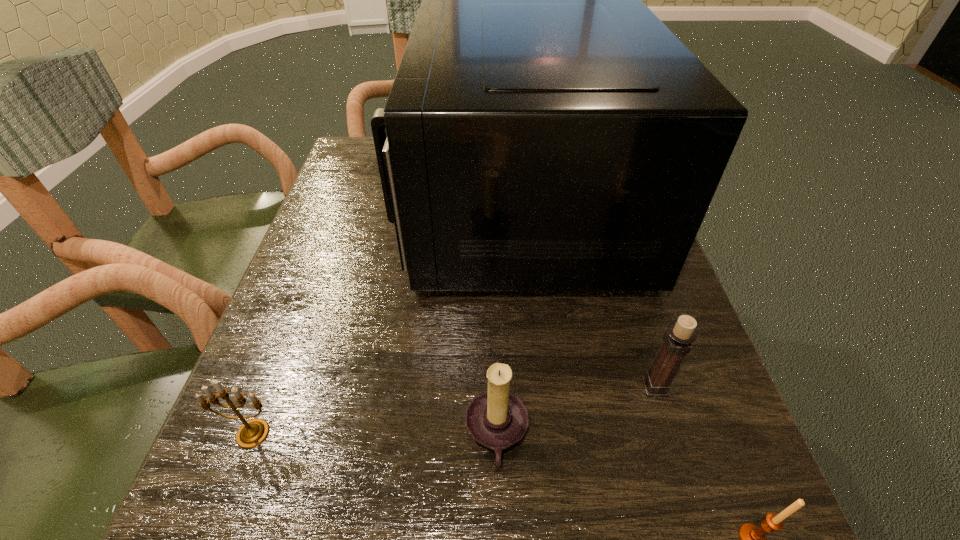
The image size is (960, 540). In the image, there is a desktop. What are the coordinates of `free space at the right edge` in the screenshot? It's located at (687, 372).

Where is `free region at the far left corner of the desktop`? This screenshot has width=960, height=540. free region at the far left corner of the desktop is located at coordinates (354, 178).

In the image, there is a desktop. Identify the location of free space at the near right corner. (640, 535).

This screenshot has width=960, height=540. I want to click on free space between the second farthest object and the tallest object, so click(586, 297).

The height and width of the screenshot is (540, 960). I want to click on free point between the farthest candle_holder and the third candle_holder from right to left, so click(576, 411).

You are a GUI agent. You are given a task and a screenshot of the screen. Output one action in this format:
    pyautogui.click(x=<x>, y=<y>)
    Task: Click on the free space between the second candle_holder from left to right and the leftmost candle_holder
    This screenshot has height=540, width=960.
    Given the screenshot: What is the action you would take?
    (374, 434)

You are a GUI agent. You are given a task and a screenshot of the screen. Output one action in this format:
    pyautogui.click(x=<x>, y=<y>)
    Task: Click on the free spot between the third candle_holder from left to right and the farthest object
    The height and width of the screenshot is (540, 960).
    Given the screenshot: What is the action you would take?
    pyautogui.click(x=586, y=297)

Find the location of a particular element. The width and height of the screenshot is (960, 540). free space between the third candle_holder from left to right and the leftmost candle_holder is located at coordinates (454, 410).

This screenshot has height=540, width=960. What are the coordinates of `empty space that is in between the tallest object and the second candle_holder from left to right` in the screenshot? It's located at (507, 321).

You are a GUI agent. You are given a task and a screenshot of the screen. Output one action in this format:
    pyautogui.click(x=<x>, y=<y>)
    Task: Click on the object that is the third closest to the third candle_holder from right to left
    The height and width of the screenshot is (540, 960).
    Given the screenshot: What is the action you would take?
    point(752,538)